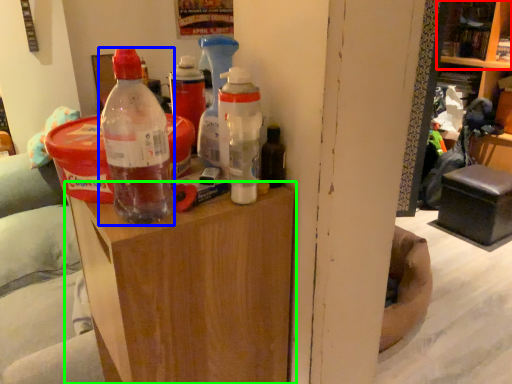
Question: Estimate the real-world distances between objects in this image. Which object is closer to shelf (highlighted by a red box), bottle (highlighted by a blue box) or furniture (highlighted by a green box)?

Choices:
 (A) bottle
 (B) furniture

Answer: (A)